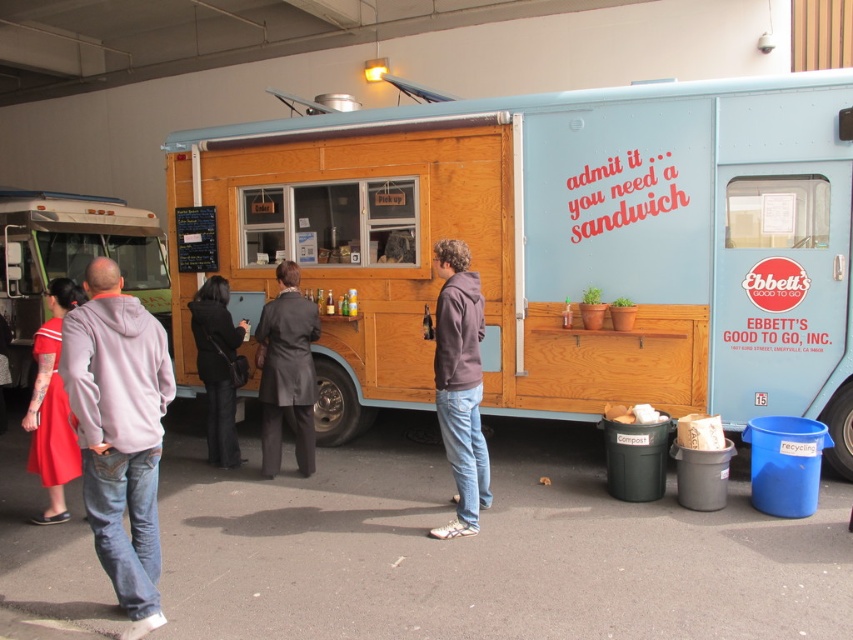
You are a photographer standing 2 meters away from the food truck. You want to take a photo of both the dark gray suit at center and the matte red dress at lower left in the same frame. Can you capture both subjects without moving your camera position?

The dark gray suit at center is 1.57 meters away from the matte red dress at lower left. Since you are standing 2 meters away from the food truck, the distance between the two subjects is less than your distance from the truck, so yes, you can capture both subjects in the same frame without moving the camera.

You are standing at the entrance of the food truck and want to reach the condiments displayed at point [300,330]. Can you estimate how far you need to walk to get there?

The distance of point [300,330] from the camera is 5.90 meters, so you need to walk approximately 5.90 meters to reach the condiments at that point.

You are at the food truck scene described. You need to locate the gray hoodie at center. Where exactly is it positioned in terms of coordinates?

The gray hoodie at center is positioned at coordinates point (119, 433).